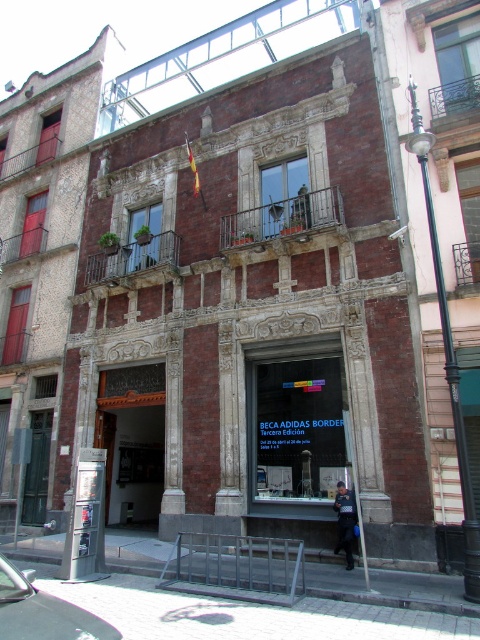
You are standing in front of the historic building and want to determine which of the two points, point (x=382, y=531) or point (x=343, y=516), is closer to you. Based on the image, which point is nearer?

Point (x=382, y=531) is further to the viewer than point (x=343, y=516), so the closer point is point (x=343, y=516).

You are a tourist standing in front of a historic building. You see a brick facade storefront at center and a dark blue uniform at center. Which object is positioned to the left from your perspective?

The brick facade storefront at center is positioned to the left of the dark blue uniform at center from your perspective.